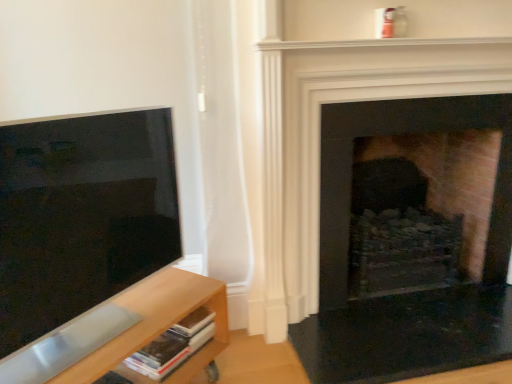
Locate an element on the screen. Image resolution: width=512 pixels, height=384 pixels. vacant region below matte black screen at left (from a real-world perspective) is located at coordinates (114, 324).